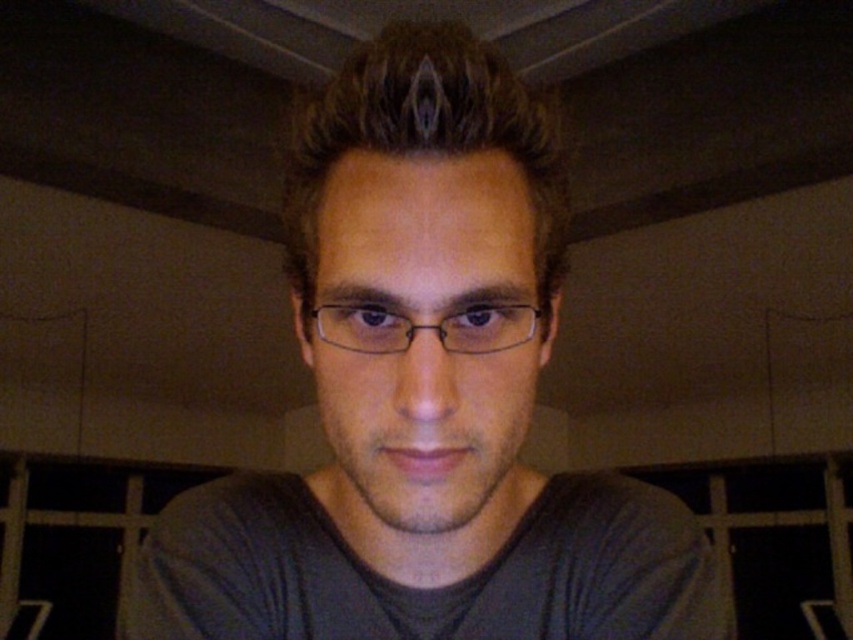
Image resolution: width=853 pixels, height=640 pixels. What do you see at coordinates (424, 134) in the screenshot? I see `brown matte hair at center` at bounding box center [424, 134].

Is brown matte hair at center further to the viewer compared to clear plastic glasses at center?

No.

Image resolution: width=853 pixels, height=640 pixels. Describe the element at coordinates (424, 134) in the screenshot. I see `brown matte hair at center` at that location.

This screenshot has width=853, height=640. I want to click on brown matte hair at center, so click(424, 134).

How distant is gray matte shirt at center from brown matte hair at center?

The distance of gray matte shirt at center from brown matte hair at center is 6.13 centimeters.

Measure the distance between gray matte shirt at center and brown matte hair at center.

gray matte shirt at center is 2.41 inches away from brown matte hair at center.

Describe the element at coordinates (426, 400) in the screenshot. I see `gray matte shirt at center` at that location.

Where is `gray matte shirt at center`? Image resolution: width=853 pixels, height=640 pixels. gray matte shirt at center is located at coordinates (426, 400).

Can you confirm if gray matte shirt at center is positioned to the right of clear plastic glasses at center?

In fact, gray matte shirt at center is to the left of clear plastic glasses at center.

In order to click on gray matte shirt at center in this screenshot , I will do `click(426, 400)`.

Locate an element on the screen. Image resolution: width=853 pixels, height=640 pixels. gray matte shirt at center is located at coordinates (426, 400).

Identify the location of gray matte shirt at center. (426, 400).